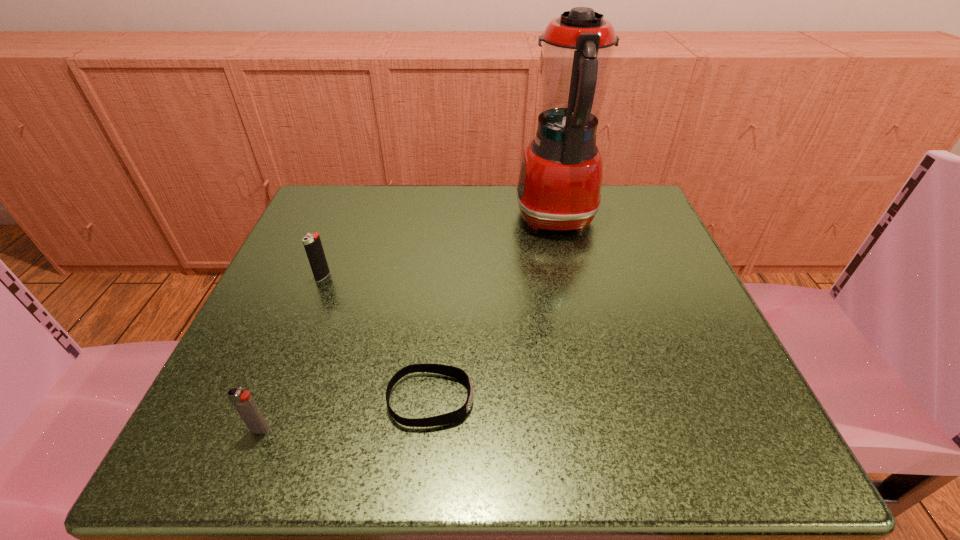
Find the location of a particular element. The height and width of the screenshot is (540, 960). the farthest object is located at coordinates (560, 179).

Locate an element on the screen. This screenshot has height=540, width=960. the tallest object is located at coordinates (560, 179).

Identify the location of the farther igniter. Image resolution: width=960 pixels, height=540 pixels. (312, 243).

Image resolution: width=960 pixels, height=540 pixels. I want to click on the nearer igniter, so [243, 402].

Locate an element on the screen. Image resolution: width=960 pixels, height=540 pixels. the shortest object is located at coordinates (451, 371).

Image resolution: width=960 pixels, height=540 pixels. I want to click on wristband, so click(451, 371).

Find the location of a particular element. vacant space located on the controls of the rightmost object is located at coordinates (450, 219).

You are a GUI agent. You are given a task and a screenshot of the screen. Output one action in this format:
    pyautogui.click(x=<x>, y=<y>)
    Task: Click on the vacant point located on the controls of the rightmost object
    
    Given the screenshot: What is the action you would take?
    pyautogui.click(x=426, y=219)

At what (x,y) coordinates should I click in order to perform the action: click on vacant space located 0.100m on the controls of the rightmost object. Please return your answer as a coordinate pair (x, y). The image size is (960, 540). Looking at the image, I should click on (468, 219).

This screenshot has width=960, height=540. I want to click on vacant space located on the right of the third nearest object, so click(x=459, y=276).